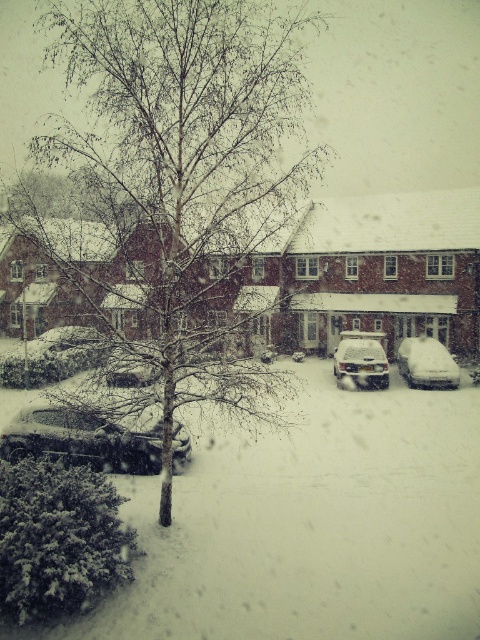
You are a delivery driver who needs to park your shiny silver car at lower left and sleek silver sedan at center in a parking lot with limited space. Which vehicle should you park first to maximize the available space?

The shiny silver car at lower left is larger than the sleek silver sedan at center. To maximize available space, you should park the larger vehicle first, so park the shiny silver car at lower left first.

You are a delivery person trying to park your shiny silver car at lower left in a narrow alley between two buildings. The alley has a height restriction sign stating that vehicles must not exceed the height of the sleek silver sedan at center. Can your car pass through the alley without hitting the overhead barrier?

The shiny silver car at lower left has a lesser height compared to the sleek silver sedan at center. Since the alley allows vehicles up to the height of the sedan, the car can pass through safely without hitting the overhead barrier.